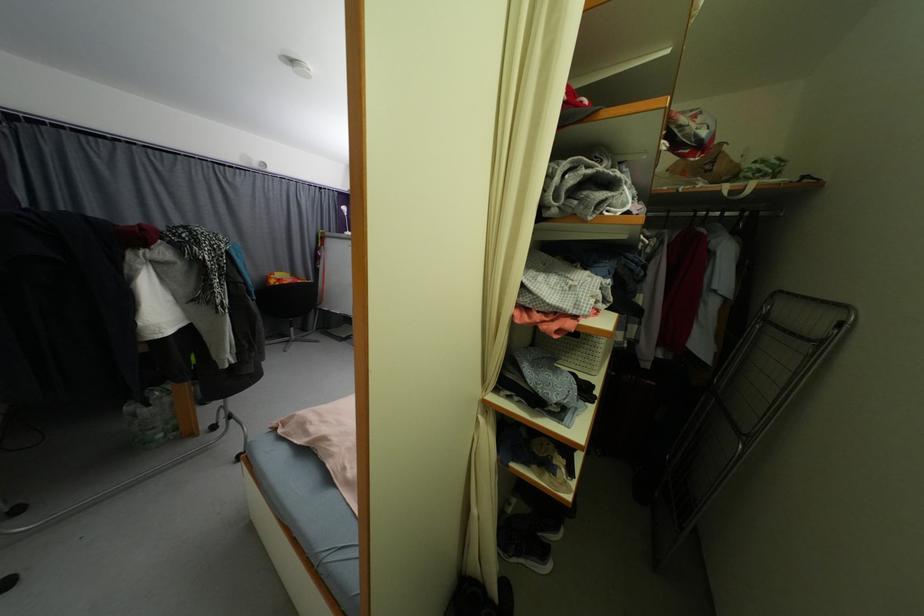
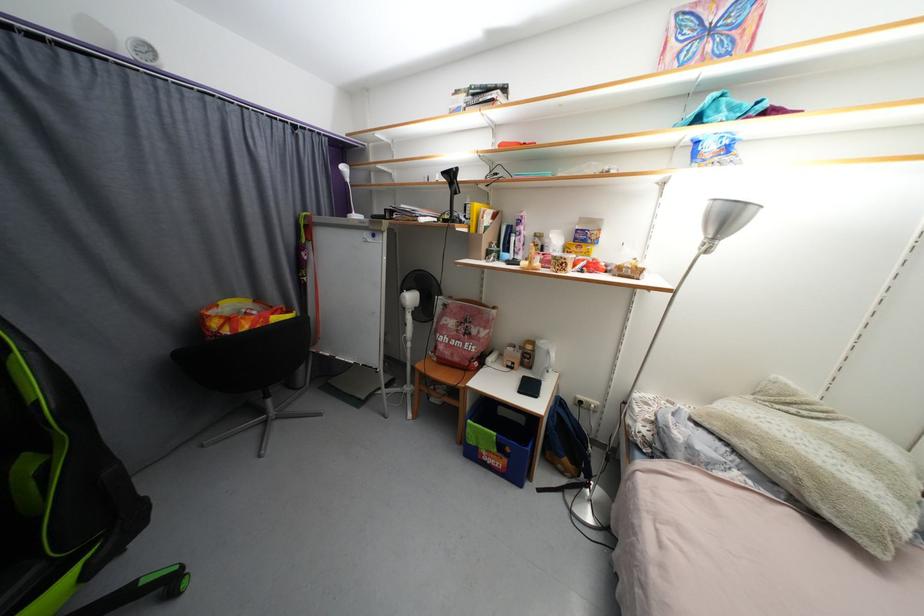
What movement of the cameraman would produce the second image?

The cameraman moved toward left, forward.